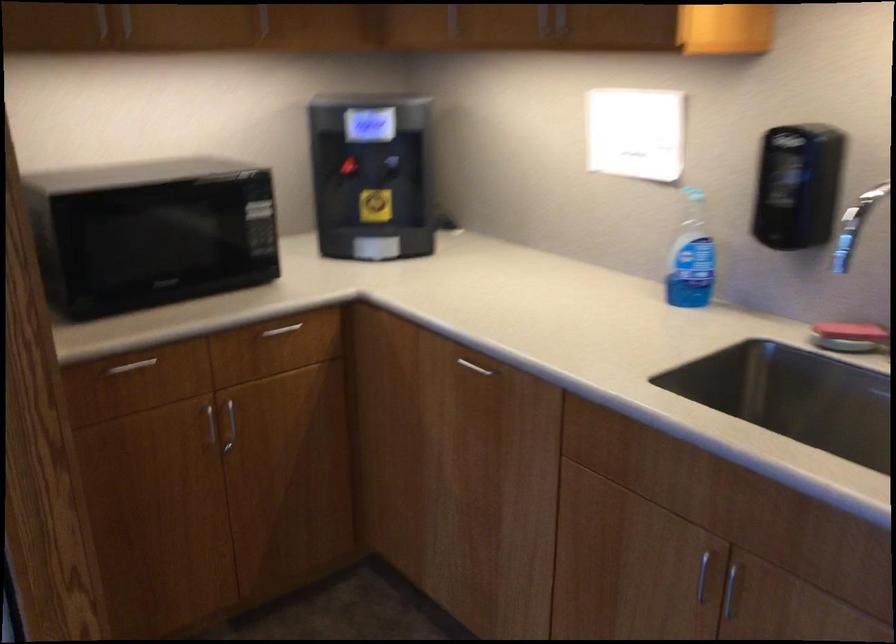
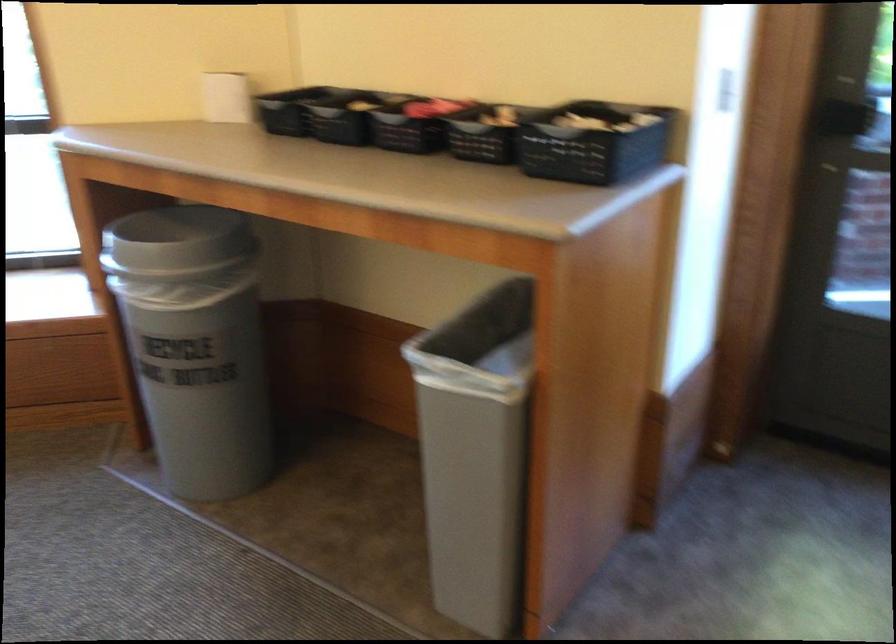
The first image is from the beginning of the video and the second image is from the end. How did the camera likely rotate when shooting the video?

The camera's rotation is toward left-down.